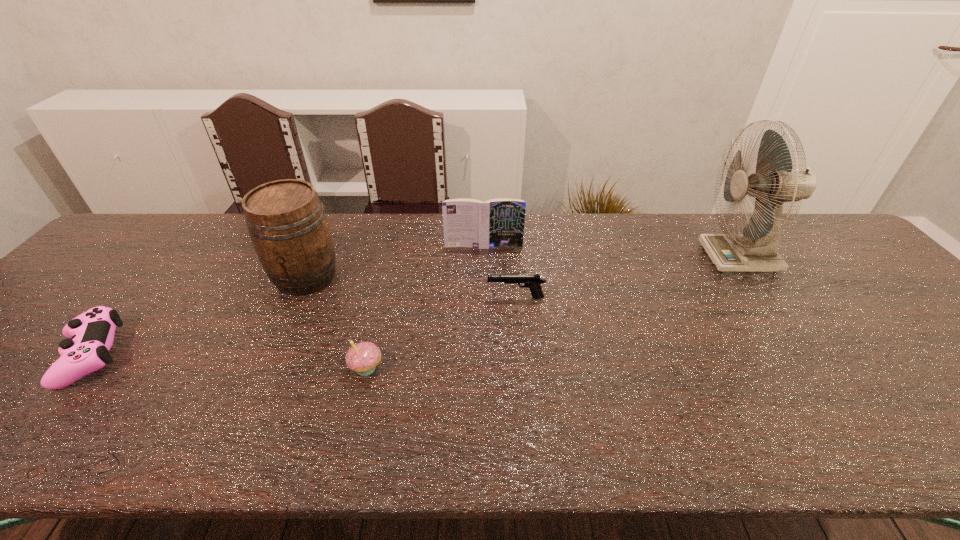
The width and height of the screenshot is (960, 540). In order to click on cider that is at the far edge in this screenshot , I will do `click(287, 224)`.

At what (x,y) coordinates should I click in order to perform the action: click on book at the far edge. Please return your answer as a coordinate pair (x, y). Looking at the image, I should click on (499, 222).

Where is `object located at the left edge`? Image resolution: width=960 pixels, height=540 pixels. object located at the left edge is located at coordinates (90, 335).

This screenshot has height=540, width=960. In the image, there is a desktop. Find the location of `vacant area at the far edge`. vacant area at the far edge is located at coordinates (803, 258).

In the image, there is a desktop. Identify the location of vacant space at the near edge. This screenshot has width=960, height=540. (709, 456).

At what (x,y) coordinates should I click in order to perform the action: click on vacant space at the left edge. Please return your answer as a coordinate pair (x, y). Looking at the image, I should click on (90, 282).

Identify the location of free space at the far right corner. Image resolution: width=960 pixels, height=540 pixels. (805, 218).

I want to click on vacant region between the fourth shortest object and the tallest object, so click(x=612, y=252).

Where is `empty space between the cupcake and the tallest object`? The height and width of the screenshot is (540, 960). empty space between the cupcake and the tallest object is located at coordinates (553, 313).

Locate an element on the screen. This screenshot has height=540, width=960. free space between the book and the third object from left to right is located at coordinates (425, 307).